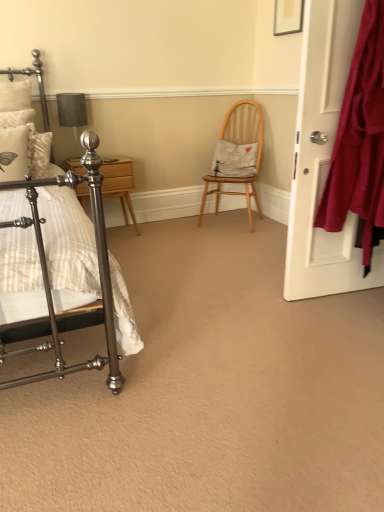
Image resolution: width=384 pixels, height=512 pixels. What do you see at coordinates (71, 109) in the screenshot?
I see `matte gray fabric at upper left` at bounding box center [71, 109].

Locate an element on the screen. The width and height of the screenshot is (384, 512). white textured pillow at left, which appears as the 1th pillow when viewed from the front is located at coordinates (17, 118).

From the image's perspective, between polished wood nightstand at left and matte white door at right, who is located below?

From the image's view, matte white door at right is below.

Is polished wood nightstand at left outside of matte white door at right?

Yes.

Considering the points (103, 197) and (295, 186), which point is behind, point (103, 197) or point (295, 186)?

The point (103, 197) is farther.

Can you tell me how much polished wood nightstand at left and white fabric pillow at center, which is the second pillow in left-to-right order, differ in facing direction?

The facing directions of polished wood nightstand at left and white fabric pillow at center, which is the second pillow in left-to-right order, are 46.8 degrees apart.

Considering their positions, is polished wood nightstand at left located in front of or behind white fabric pillow at center, arranged as the first pillow when viewed from the back?

polished wood nightstand at left is in front of white fabric pillow at center, arranged as the first pillow when viewed from the back.

Locate an element on the screen. Image resolution: width=384 pixels, height=512 pixels. pillow that is the 1st one above the polished wood nightstand at left (from a real-world perspective) is located at coordinates (234, 159).

Is white textured pillow at left, which appears as the 1th pillow when viewed from the front, in contact with polished wood nightstand at left?

No, white textured pillow at left, which appears as the 1th pillow when viewed from the front, is not beside polished wood nightstand at left.

Is white textured pillow at left, which is the 2th pillow in back-to-front order, oriented towards polished wood nightstand at left?

No.

I want to click on the 2nd pillow above when counting from the polished wood nightstand at left (from the image's perspective), so click(17, 118).

Is white textured pillow at left, which appears as the 1th pillow when viewed from the front, thinner than polished wood nightstand at left?

Yes.

Would you say polished metal bed at left is a long distance from matte white door at right?

polished metal bed at left is far away from matte white door at right.

From the image's perspective, is polished metal bed at left above or below matte white door at right?

polished metal bed at left is situated lower than matte white door at right in the image.

Where is `door that appears on the right of polished metal bed at left`? The width and height of the screenshot is (384, 512). door that appears on the right of polished metal bed at left is located at coordinates [x=323, y=159].

Is white fabric pillow at center, which is the second pillow in left-to-right order, looking in the opposite direction of matte gray fabric at upper left?

white fabric pillow at center, which is the second pillow in left-to-right order, is not turned away from matte gray fabric at upper left.

Is white fabric pillow at center, arranged as the first pillow when viewed from the back, behind matte gray fabric at upper left?

Yes, white fabric pillow at center, arranged as the first pillow when viewed from the back, is further from the camera.

Does point (247, 156) come behind point (63, 109)?

Yes, point (247, 156) is farther from viewer.

Does white fabric pillow at center, marked as the first pillow in a right-to-left arrangement, contain matte gray fabric at upper left?

No.

Is matte white door at right looking in the opposite direction of white fabric pillow at center, which is counted as the second pillow, starting from the front?

No.

Considering the sizes of objects matte white door at right and white fabric pillow at center, which is the second pillow in left-to-right order, in the image provided, who is shorter, matte white door at right or white fabric pillow at center, which is the second pillow in left-to-right order,?

white fabric pillow at center, which is the second pillow in left-to-right order, is shorter.

Is matte white door at right not inside white fabric pillow at center, which is counted as the second pillow, starting from the front?

matte white door at right is positioned outside white fabric pillow at center, which is counted as the second pillow, starting from the front.

From a real-world perspective, does matte white door at right sit lower than white fabric pillow at center, which is the second pillow in left-to-right order?

Actually, matte white door at right is physically above white fabric pillow at center, which is the second pillow in left-to-right order, in the real world.

Based on their sizes in the image, would you say polished wood nightstand at left is bigger or smaller than white textured pillow at left, which is the second pillow in right-to-left order?

polished wood nightstand at left is bigger than white textured pillow at left, which is the second pillow in right-to-left order.

Is polished wood nightstand at left far away from white textured pillow at left, placed as the 1th pillow when sorted from left to right?

They are positioned close to each other.

Who is more distant, polished wood nightstand at left or white textured pillow at left, which is the 2th pillow in back-to-front order?

Positioned behind is polished wood nightstand at left.

From the image's perspective, between polished wood nightstand at left and white textured pillow at left, which is the second pillow in right-to-left order, who is located below?

polished wood nightstand at left.

The width and height of the screenshot is (384, 512). In order to click on nightstand below the matte white door at right (from a real-world perspective) in this screenshot , I will do coord(120,184).

Identify the location of pillow behind the polished wood nightstand at left. (234, 159).

Which object lies further to the anchor point white fabric pillow at center, which is the second pillow in left-to-right order, wooden chair at center or matte gray fabric at upper left?

Based on the image, matte gray fabric at upper left appears to be further to white fabric pillow at center, which is the second pillow in left-to-right order.

Consider the image. Estimate the real-world distances between objects in this image. Which object is further from matte gray fabric at upper left, white fabric pillow at center, which is counted as the second pillow, starting from the front, or polished wood nightstand at left?

Among the two, white fabric pillow at center, which is counted as the second pillow, starting from the front, is located further to matte gray fabric at upper left.

When comparing their distances from matte white door at right, does white textured pillow at left, placed as the 1th pillow when sorted from left to right, or polished wood nightstand at left seem further?

Based on the image, white textured pillow at left, placed as the 1th pillow when sorted from left to right, appears to be further to matte white door at right.

Which object lies nearer to the anchor point white textured pillow at left, which appears as the 1th pillow when viewed from the front, polished metal bed at left or polished wood nightstand at left?

polished metal bed at left is positioned closer to the anchor white textured pillow at left, which appears as the 1th pillow when viewed from the front.

Estimate the real-world distances between objects in this image. Which object is further from polished wood nightstand at left, polished metal bed at left or matte gray fabric at upper left?

Based on the image, polished metal bed at left appears to be further to polished wood nightstand at left.

Which object lies nearer to the anchor point matte gray fabric at upper left, matte white door at right or polished wood nightstand at left?

polished wood nightstand at left.

When comparing their distances from white fabric pillow at center, which is counted as the second pillow, starting from the front, does matte gray fabric at upper left or white textured pillow at left, placed as the 1th pillow when sorted from left to right, seem closer?

Based on the image, matte gray fabric at upper left appears to be nearer to white fabric pillow at center, which is counted as the second pillow, starting from the front.

From the image, which object appears to be nearer to polished metal bed at left, wooden chair at center or white textured pillow at left, which is the 2th pillow in back-to-front order?

Based on the image, white textured pillow at left, which is the 2th pillow in back-to-front order, appears to be nearer to polished metal bed at left.

The width and height of the screenshot is (384, 512). I want to click on table lamp between polished metal bed at left and white fabric pillow at center, marked as the first pillow in a right-to-left arrangement, along the z-axis, so click(x=71, y=109).

What are the coordinates of `table lamp situated between white textured pillow at left, which is the 2th pillow in back-to-front order, and white fabric pillow at center, marked as the first pillow in a right-to-left arrangement, from left to right` in the screenshot? It's located at click(x=71, y=109).

Image resolution: width=384 pixels, height=512 pixels. I want to click on chair positioned between polished metal bed at left and white fabric pillow at center, which is counted as the second pillow, starting from the front, from near to far, so click(237, 156).

Where is `door between polished metal bed at left and matte gray fabric at upper left from front to back`? The width and height of the screenshot is (384, 512). door between polished metal bed at left and matte gray fabric at upper left from front to back is located at coordinates (323, 159).